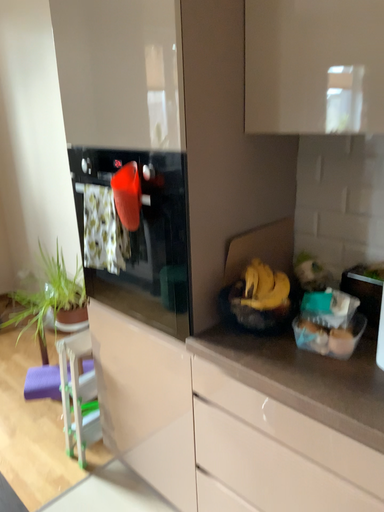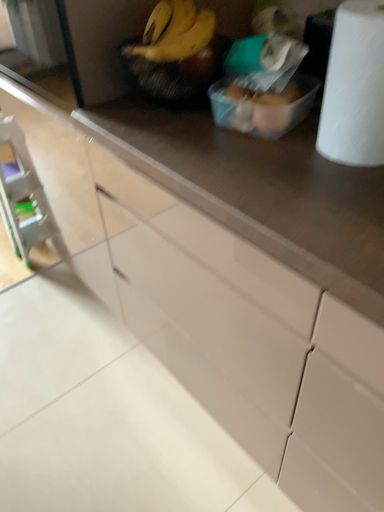
Question: Which way did the camera rotate in the video?

Choices:
 (A) rotated upward
 (B) rotated downward

Answer: (B)